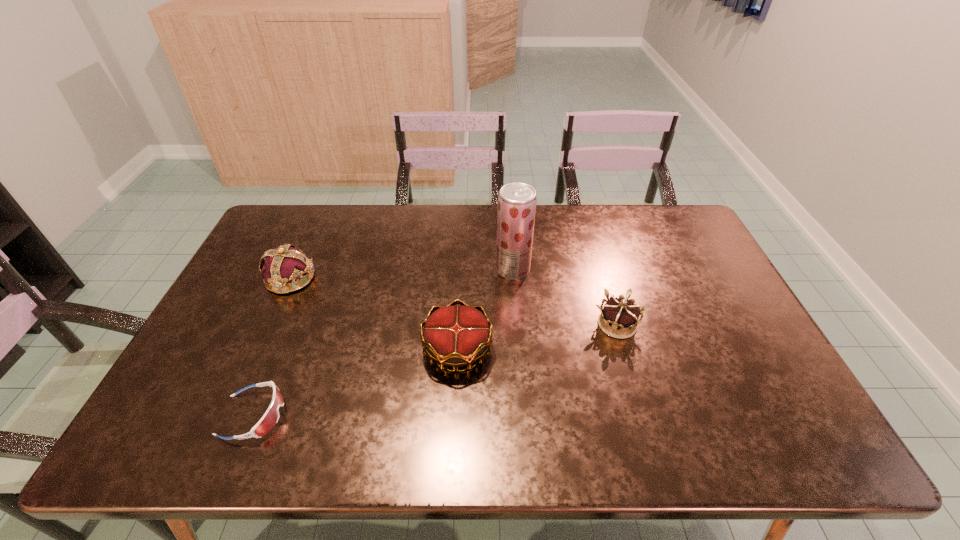
Locate an element on the screen. blank area located on the right of the second crown from left to right is located at coordinates (564, 349).

At what (x,y) coordinates should I click in order to perform the action: click on free space located on the left of the rightmost object. Please return your answer as a coordinate pair (x, y). Image resolution: width=960 pixels, height=540 pixels. Looking at the image, I should click on (513, 325).

The image size is (960, 540). In order to click on free spot located on the front-facing side of the nearest object in this screenshot , I will do `click(437, 415)`.

I want to click on object located at the near edge, so click(x=270, y=418).

Where is `crown present at the left edge`? crown present at the left edge is located at coordinates (285, 264).

Where is `goggles situated at the left edge`? goggles situated at the left edge is located at coordinates (270, 418).

Locate an element on the screen. The image size is (960, 540). object positioned at the near left corner is located at coordinates (270, 418).

Identify the location of free space at the far edge. This screenshot has height=540, width=960. [565, 206].

Where is `vacant space at the near edge`? The height and width of the screenshot is (540, 960). vacant space at the near edge is located at coordinates coord(563,425).

The width and height of the screenshot is (960, 540). In the image, there is a desktop. Identify the location of vacant space at the left edge. (201, 409).